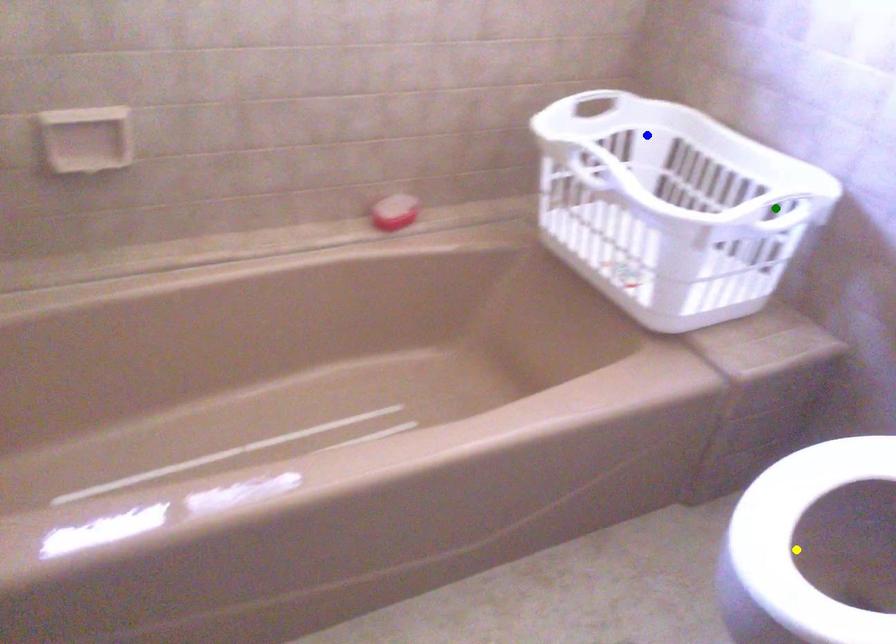
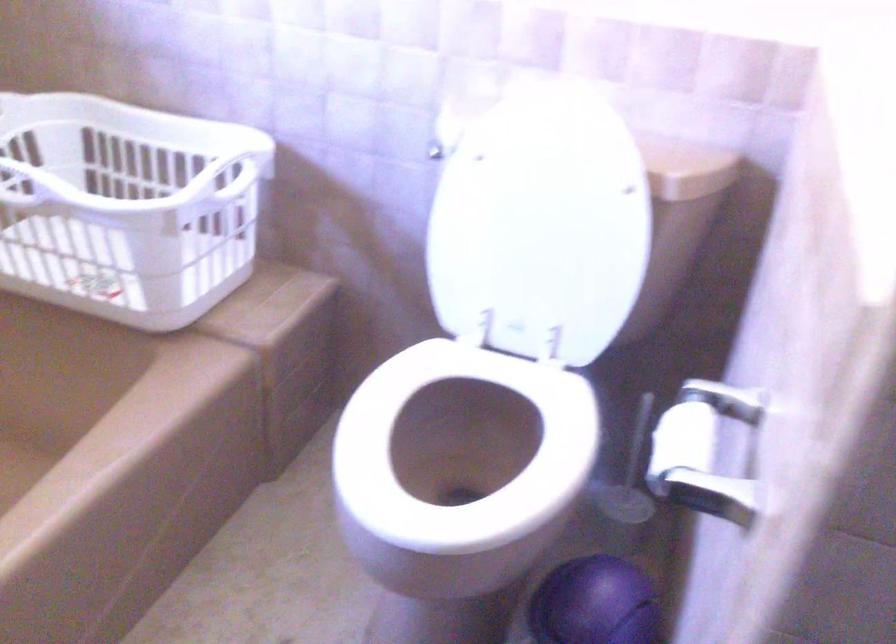
I am providing you with two images of the same scene from different viewpoints. Three points are marked in image1. Which point corresponds to a part or object that is occluded in image2?In image1, three points are marked. Which of them correspond to a part or object that is occluded in image2?Among the three points shown in image1, which one corresponds to a part or object that is no longer visible due to occlusion in image2?

yellow point cannot be seen in image2.